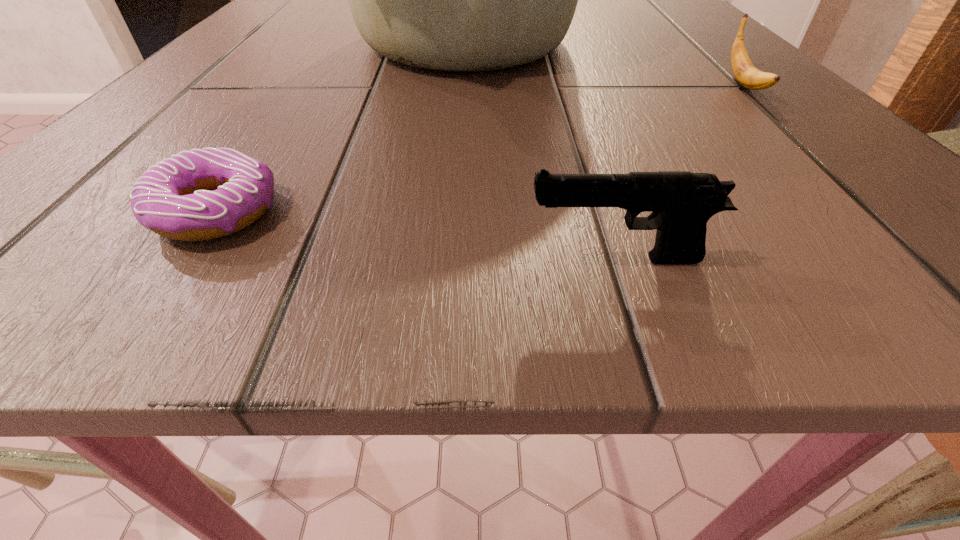
At what (x,y) coordinates should I click in order to perform the action: click on free area in between the pistol and the tallest object. Please return your answer as a coordinate pair (x, y). The width and height of the screenshot is (960, 540). Looking at the image, I should click on (542, 151).

Where is `free space between the doughnut and the pistol`? free space between the doughnut and the pistol is located at coordinates (417, 235).

This screenshot has width=960, height=540. I want to click on the third closest object to the banana, so click(x=174, y=199).

This screenshot has width=960, height=540. Identify the location of the closest object to the pistol. (174, 199).